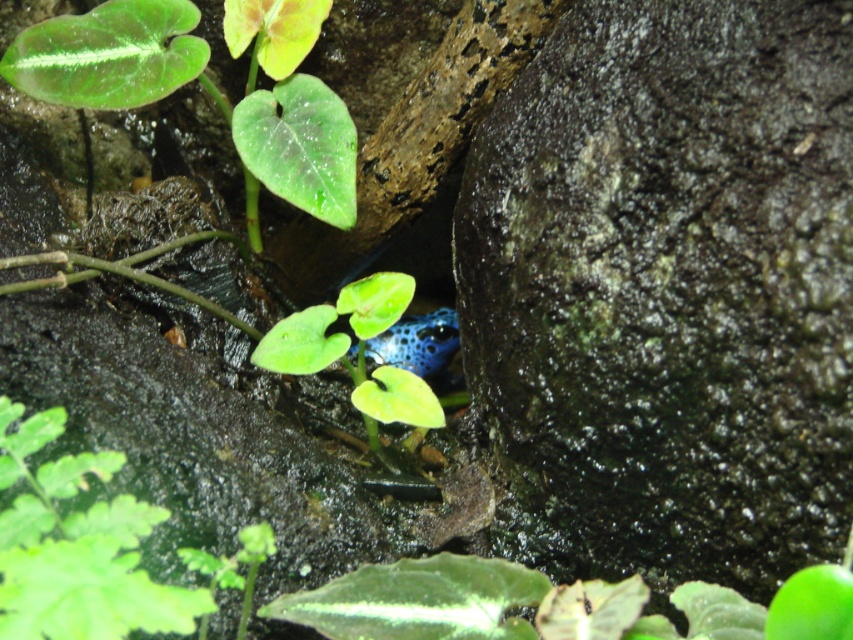
This screenshot has width=853, height=640. What are the coordinates of `green leafy plant at lower left` in the screenshot? It's located at (76, 547).

Is point (19, 80) positioned after point (50, 492)?

Yes.

Is point (190, 40) in front of point (26, 564)?

No, (190, 40) is behind (26, 564).

The height and width of the screenshot is (640, 853). Identify the location of green glossy leaf at upper left. (207, 88).

Is point (26, 60) closer to camera compared to point (328, 308)?

No, it is not.

The image size is (853, 640). Identify the location of green glossy leaf at upper left. (207, 88).